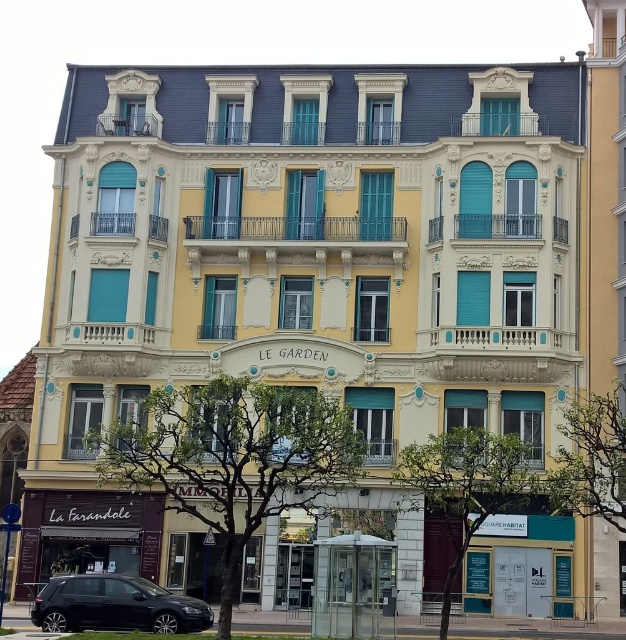
You are standing at the origin point in the image. Which direction should you move to reach the yellow matte building at right?

The yellow matte building at right is located at coordinates point (x=603, y=198), so you should move northeast to reach it.

In the scene shown: You are a delivery driver who needs to park your shiny black car at lower left near the yellow matte building at right. Considering the width of both objects, will your car fit alongside the building without overlapping?

The yellow matte building at right has a lesser width compared to shiny black car at lower left. Therefore, the car is wider than the building, so it might not fit alongside without overlapping unless there is sufficient space allocated for its width.

You are a photographer standing in front of the scene. You want to capture both the yellow matte building at right and the shiny black car at lower left in a single frame. Which object should you focus on first to ensure both are in the frame?

You should focus on the yellow matte building at right first because it is taller than the shiny black car at lower left, so adjusting the camera angle to include its height will naturally include the car in the frame as well.